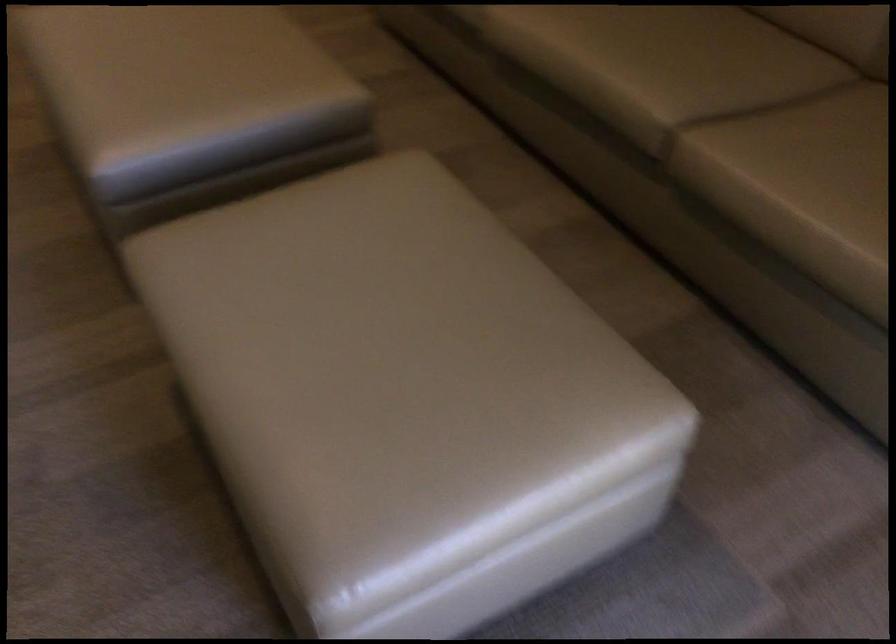
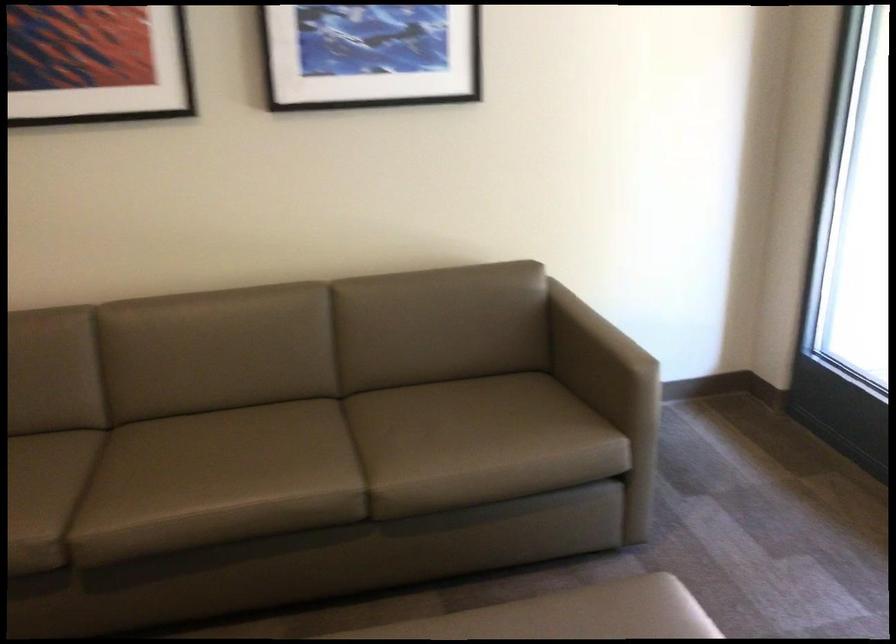
In the second image, find the point that corresponds to point 754,116 in the first image.

(356, 450)